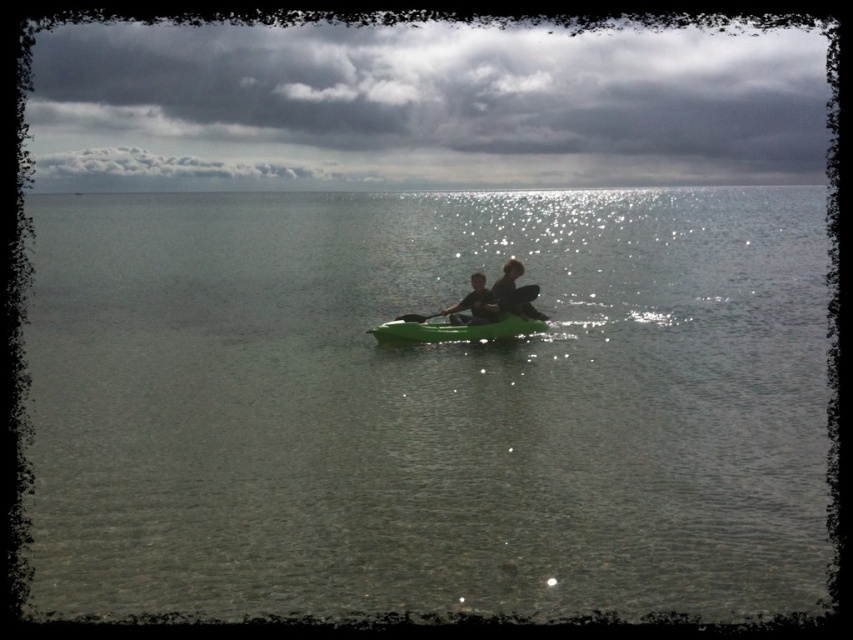
You are a photographer trying to capture the kayaks in the image. You notice that the green plastic kayak at center and the smooth black kayak at center are positioned in a way that one is partially hidden by the other. Which kayak is blocking the view of the other?

The smooth black kayak at center is blocking the view of the green plastic kayak at center because it is positioned above it.

You are standing on a dock and see the green plastic kayak at center in the distance. If you need to throw a lifebuoy to reach it, and the lifebuoy can travel 20 meters, will it be sufficient?

The distance of green plastic kayak at center from camera is 19.68 meters, so yes, the lifebuoy can reach it since it can travel 20 meters which is farther than the required distance.

You are planning to store the green plastic kayak at center and the smooth black kayak at center in a garage with a height restriction of 1.5 meters. Given their height difference, which kayak might not fit under the height limit?

The green plastic kayak at center is taller than the smooth black kayak at center, so the green plastic kayak at center might not fit under the 1.5 meters height limit.